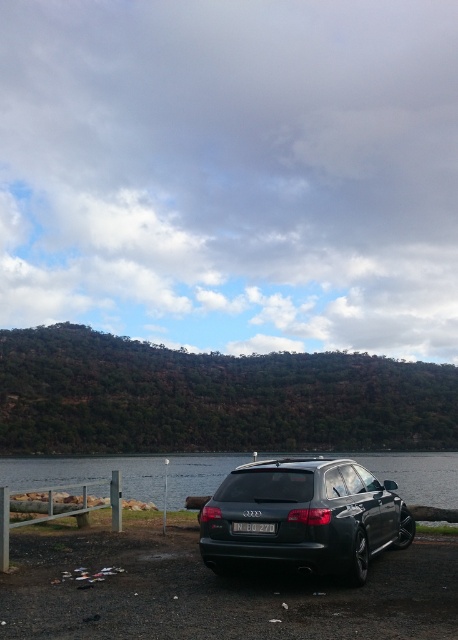
Can you confirm if dark metallic car at center is thinner than white plastic license plate at center?

In fact, dark metallic car at center might be wider than white plastic license plate at center.

Does dark metallic car at center have a greater height compared to white plastic license plate at center?

Yes.

I want to click on dark metallic car at center, so click(x=305, y=516).

Based on the photo, does clear water at lower center come in front of white plastic license plate at center?

No, clear water at lower center is further to the viewer.

Is clear water at lower center to the right of white plastic license plate at center from the viewer's perspective?

Incorrect, clear water at lower center is not on the right side of white plastic license plate at center.

The width and height of the screenshot is (458, 640). What do you see at coordinates (87, 474) in the screenshot? I see `clear water at lower center` at bounding box center [87, 474].

At what (x,y) coordinates should I click in order to perform the action: click on clear water at lower center. Please return your answer as a coordinate pair (x, y). Looking at the image, I should click on (87, 474).

Between dark metallic car at center and clear water at lower center, which one has less height?

dark metallic car at center

In the scene shown: Is dark metallic car at center closer to camera compared to clear water at lower center?

Yes, dark metallic car at center is closer to the viewer.

Identify the location of dark metallic car at center. The image size is (458, 640). (305, 516).